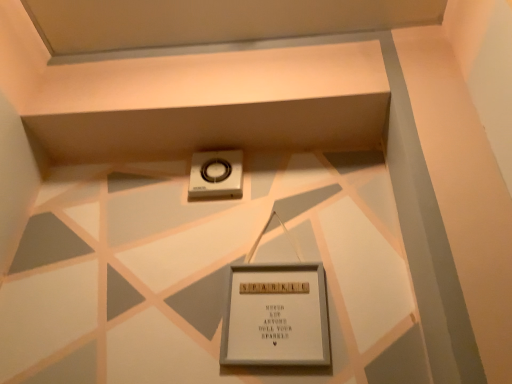
Consider the image. In order to face white wooden picture frame at center, should I rotate leftwards or rightwards?

A 2.342 degree turn to the right will do.

Where is `white wooden picture frame at center`? white wooden picture frame at center is located at coordinates (276, 316).

What do you see at coordinates (276, 316) in the screenshot? The image size is (512, 384). I see `white wooden picture frame at center` at bounding box center [276, 316].

The image size is (512, 384). Describe the element at coordinates (216, 174) in the screenshot. I see `silver metallic scale at center` at that location.

You are a GUI agent. You are given a task and a screenshot of the screen. Output one action in this format:
    pyautogui.click(x=<x>, y=<y>)
    Task: Click on the silver metallic scale at center
    The height and width of the screenshot is (384, 512).
    Given the screenshot: What is the action you would take?
    [216, 174]

The height and width of the screenshot is (384, 512). Identify the location of white wooden picture frame at center. (276, 316).

Does white wooden picture frame at center appear on the left side of silver metallic scale at center?

No.

Between white wooden picture frame at center and silver metallic scale at center, which one is positioned in front?

white wooden picture frame at center.

Considering the points (308, 325) and (213, 163), which point is in front, point (308, 325) or point (213, 163)?

The point (308, 325) is more forward.

From the image's perspective, relative to silver metallic scale at center, is white wooden picture frame at center above or below?

Based on their image positions, white wooden picture frame at center is located beneath silver metallic scale at center.

From a real-world perspective, is white wooden picture frame at center over silver metallic scale at center?

No, from a real-world perspective, white wooden picture frame at center is not over silver metallic scale at center

Considering the sizes of objects white wooden picture frame at center and silver metallic scale at center in the image provided, who is thinner, white wooden picture frame at center or silver metallic scale at center?

white wooden picture frame at center is thinner.

Is white wooden picture frame at center shorter than silver metallic scale at center?

Incorrect, the height of white wooden picture frame at center does not fall short of that of silver metallic scale at center.

Between white wooden picture frame at center and silver metallic scale at center, which one has larger size?

white wooden picture frame at center is bigger.

Is white wooden picture frame at center located outside silver metallic scale at center?

Yes, white wooden picture frame at center is not within silver metallic scale at center.

Is white wooden picture frame at center placed right next to silver metallic scale at center?

No, white wooden picture frame at center is not with silver metallic scale at center.

Is white wooden picture frame at center facing towards silver metallic scale at center?

No, white wooden picture frame at center is not oriented towards silver metallic scale at center.

Locate an element on the screen. weight scale behind the white wooden picture frame at center is located at coordinates tap(216, 174).

Is silver metallic scale at center to the left of white wooden picture frame at center from the viewer's perspective?

Yes.

Considering the positions of objects silver metallic scale at center and white wooden picture frame at center in the image provided, who is in front, silver metallic scale at center or white wooden picture frame at center?

white wooden picture frame at center is in front.

Does point (190, 185) lie in front of point (282, 298)?

No, (190, 185) is behind (282, 298).

In the scene shown: From the image's perspective, would you say silver metallic scale at center is positioned over white wooden picture frame at center?

Yes, from the image's perspective, silver metallic scale at center is on top of white wooden picture frame at center.

From a real-world perspective, does silver metallic scale at center stand above white wooden picture frame at center?

Yes, from a real-world perspective, silver metallic scale at center is above white wooden picture frame at center.

Does silver metallic scale at center have a lesser width compared to white wooden picture frame at center?

No, silver metallic scale at center is not thinner than white wooden picture frame at center.

From their relative heights in the image, would you say silver metallic scale at center is taller or shorter than white wooden picture frame at center?

Considering their sizes, silver metallic scale at center has less height than white wooden picture frame at center.

Does silver metallic scale at center have a larger size compared to white wooden picture frame at center?

No.

Is silver metallic scale at center not within white wooden picture frame at center?

Absolutely, silver metallic scale at center is external to white wooden picture frame at center.

Is silver metallic scale at center touching white wooden picture frame at center?

No, silver metallic scale at center is not with white wooden picture frame at center.

Is silver metallic scale at center facing towards white wooden picture frame at center?

No, silver metallic scale at center does not turn towards white wooden picture frame at center.

How much distance is there between silver metallic scale at center and white wooden picture frame at center?

They are 15.17 inches apart.

The width and height of the screenshot is (512, 384). Identify the location of weight scale behind the white wooden picture frame at center. (216, 174).

This screenshot has height=384, width=512. Find the location of `weight scale above the white wooden picture frame at center (from the image's perspective)`. weight scale above the white wooden picture frame at center (from the image's perspective) is located at coordinates (216, 174).

The width and height of the screenshot is (512, 384). Find the location of `picture frame below the silver metallic scale at center (from a real-world perspective)`. picture frame below the silver metallic scale at center (from a real-world perspective) is located at coordinates (276, 316).